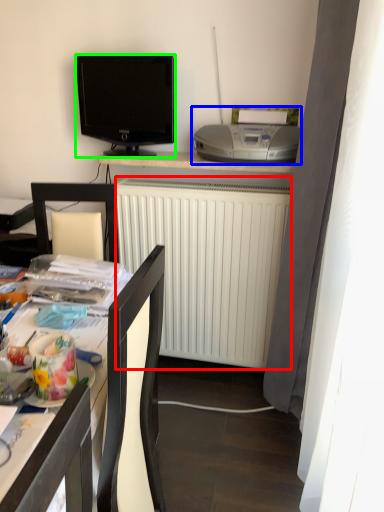
Question: Which is nearer to the radiator (highlighted by a red box)? printer (highlighted by a blue box) or television (highlighted by a green box).

Choices:
 (A) printer
 (B) television

Answer: (A)